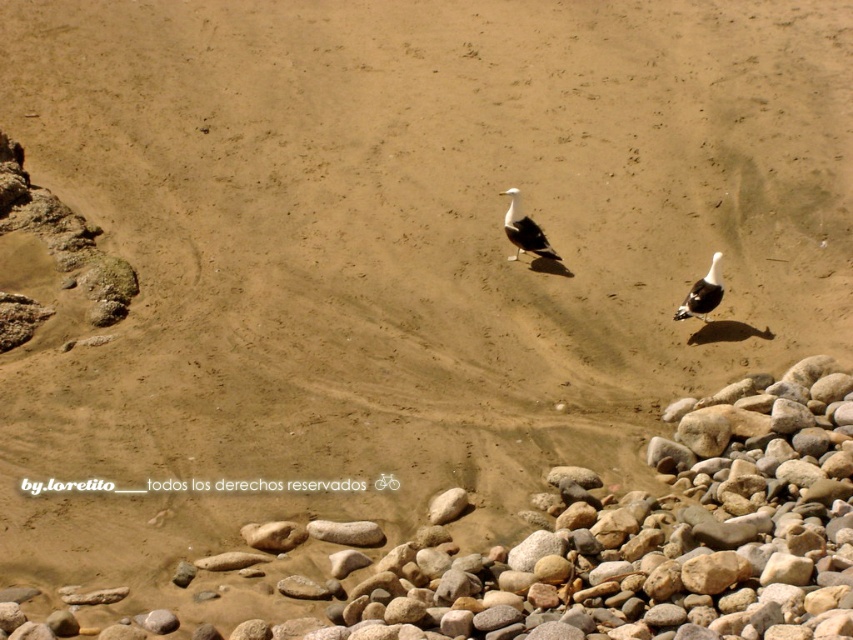
Can you confirm if smooth pebbles at lower right is bigger than white matte bird at center?

Indeed, smooth pebbles at lower right has a larger size compared to white matte bird at center.

Identify the location of smooth pebbles at lower right. The height and width of the screenshot is (640, 853). (502, 545).

Does smooth pebbles at lower right come in front of white-feathered bird at center?

Yes, it is.

Does smooth pebbles at lower right appear over white-feathered bird at center?

Actually, smooth pebbles at lower right is below white-feathered bird at center.

Is point (811, 625) farther from viewer compared to point (512, 214)?

No.

This screenshot has height=640, width=853. I want to click on smooth pebbles at lower right, so click(502, 545).

Does white-feathered bird at center appear on the left side of white matte bird at center?

Yes, white-feathered bird at center is to the left of white matte bird at center.

Does white-feathered bird at center have a lesser width compared to white matte bird at center?

No.

Locate an element on the screen. The width and height of the screenshot is (853, 640). white-feathered bird at center is located at coordinates (524, 230).

This screenshot has height=640, width=853. I want to click on white-feathered bird at center, so click(x=524, y=230).